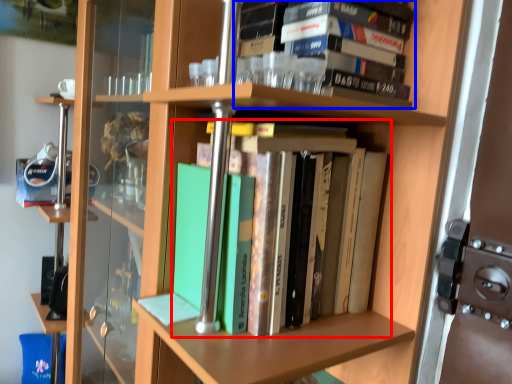
Question: Which object appears closest to the camera in this image, book (highlighted by a red box) or book (highlighted by a blue box)?

Choices:
 (A) book
 (B) book

Answer: (A)